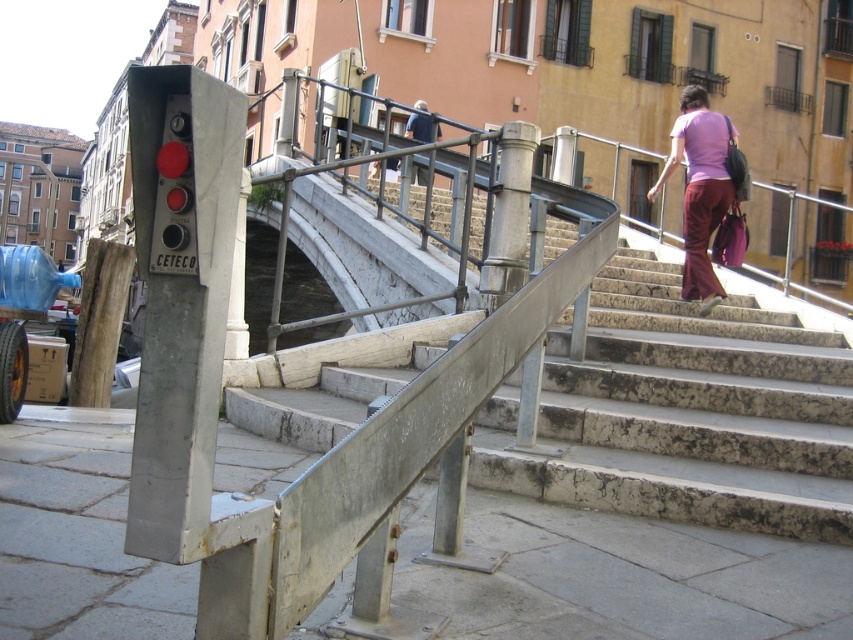
You are a tourist standing at the bottom of the stone stairs at upper center and want to take a photo of the dark blue jacket at upper center. Which direction should you face to ensure both objects are in the frame?

The stone stairs at upper center is positioned under the dark blue jacket at upper center, so you should face upward to capture both the stone stairs at upper center and the dark blue jacket at upper center in your photo.

You are standing at the point labeled by the coordinates point (683, 413) in the scene. What object are you standing on?

You are standing on the stone stairs at upper center, as the point (683, 413) represents the stone stairs at upper center.

You are standing at the bottom of the stone stairs at upper center and want to walk towards the pink fabric pants at upper right. Which direction should you face to move towards them?

You should face away from the stone stairs at upper center because the pink fabric pants at upper right are further away from the viewer, meaning they are located behind the stairs in the scene.